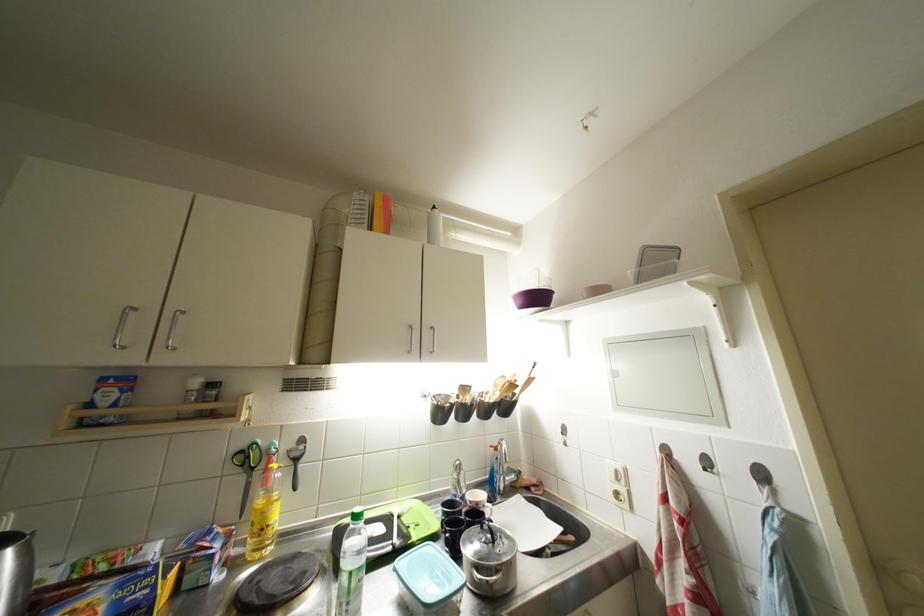
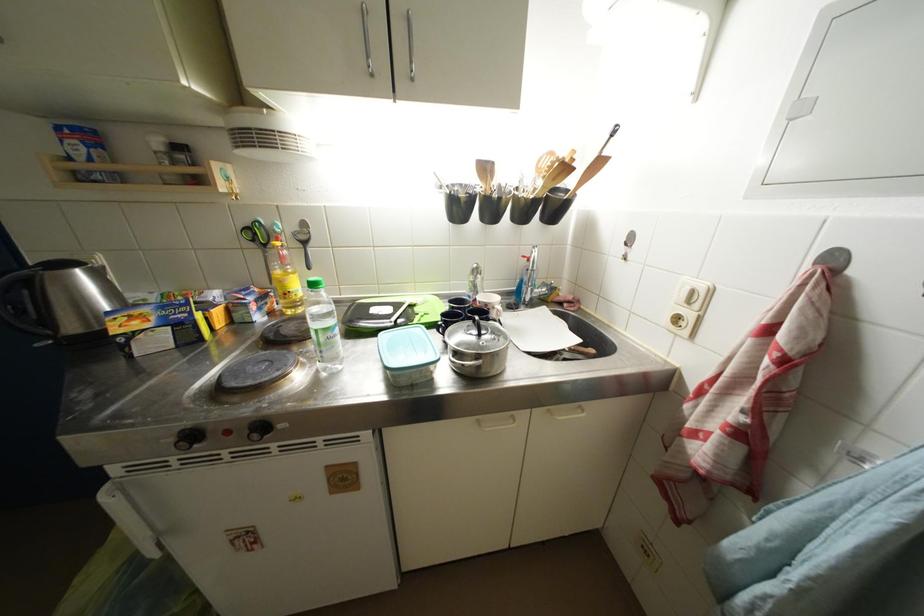
Find the pixel in the second image that matches (470,392) in the first image.

(492, 172)